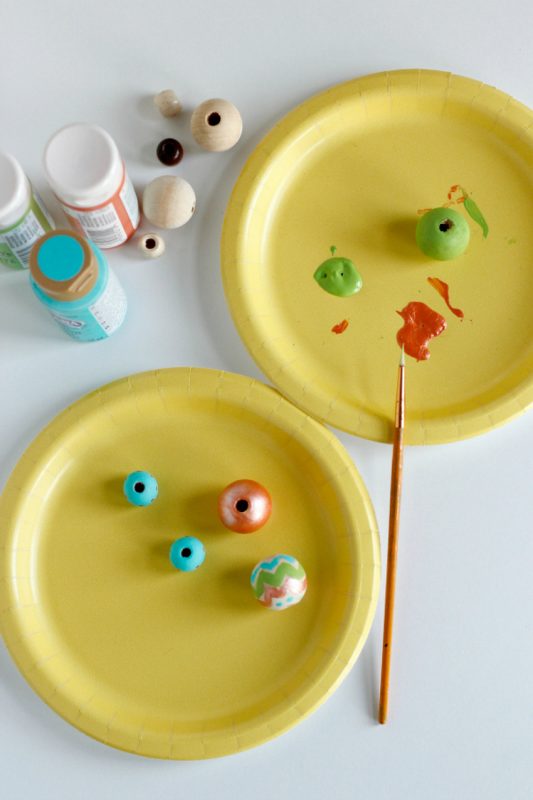
This screenshot has width=533, height=800. What are the coordinates of `blue paint` in the screenshot? It's located at (71, 306).